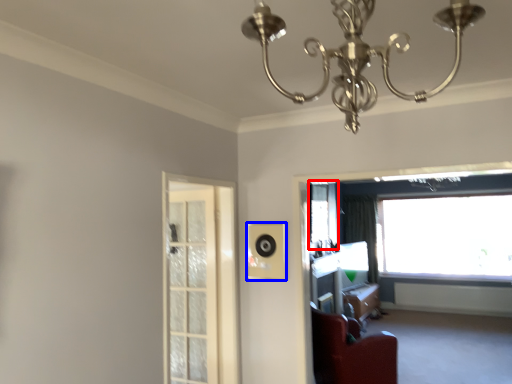
Question: Which object appears farthest to the camera in this image, window screen (highlighted by a red box) or speaker (highlighted by a blue box)?

Choices:
 (A) window screen
 (B) speaker

Answer: (A)